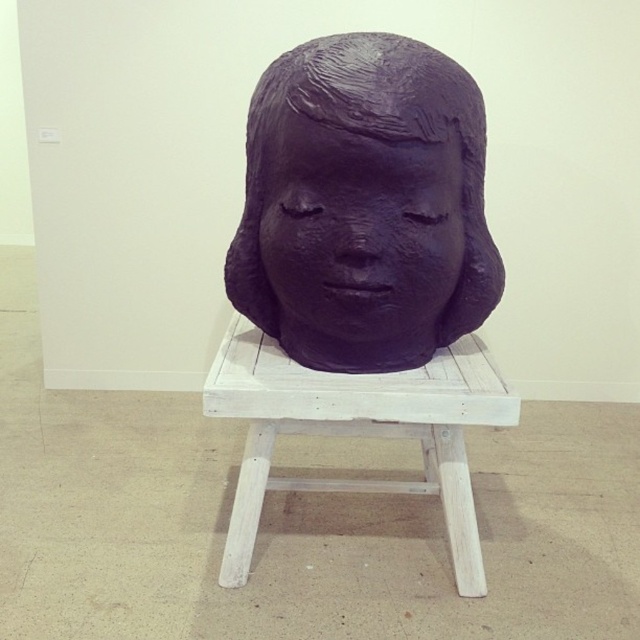
You are an art installer who needs to place a narrow shelf exactly between the purple matte sculpture at center and the white wood stool at center. Which object should the shelf be placed closer to?

The purple matte sculpture at center is thinner than the white wood stool at center, so the shelf should be placed closer to the purple matte sculpture at center to ensure it fits between them.

You are an art student standing in front of the sculpture. You want to touch the purple matte sculpture at center and the white wood stool at center. Which object will your hand reach first when moving forward?

The purple matte sculpture at center is closer to the viewer than the white wood stool at center, so your hand will reach the purple matte sculpture at center first when moving forward.

You are an art student observing the sculpture in the image. You notice two purple matte objects at the center. Which one is closer to you, the purple matte head at center or the purple matte sculpture at center?

The purple matte head at center is closer to you because it is in front of the purple matte sculpture at center.